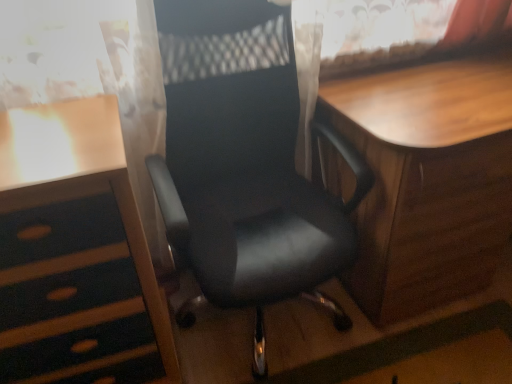
Question: From a real-world perspective, is wooden desk at left located higher than wooden table at center?

Choices:
 (A) no
 (B) yes

Answer: (B)

Question: Is the position of wooden desk at left less distant than that of wooden table at center?

Choices:
 (A) yes
 (B) no

Answer: (A)

Question: Can you confirm if wooden desk at left is smaller than wooden table at center?

Choices:
 (A) no
 (B) yes

Answer: (B)

Question: Is wooden desk at left oriented away from wooden table at center?

Choices:
 (A) yes
 (B) no

Answer: (B)

Question: Considering the relative positions of wooden desk at left and wooden table at center in the image provided, is wooden desk at left to the right of wooden table at center from the viewer's perspective?

Choices:
 (A) yes
 (B) no

Answer: (B)

Question: Visually, is wooden desk at left positioned to the left or to the right of black leather chair at center?

Choices:
 (A) left
 (B) right

Answer: (A)

Question: From the image's perspective, is wooden desk at left above or below black leather chair at center?

Choices:
 (A) below
 (B) above

Answer: (A)

Question: Is wooden desk at left spatially inside black leather chair at center, or outside of it?

Choices:
 (A) inside
 (B) outside

Answer: (B)

Question: Considering the positions of wooden desk at left and black leather chair at center in the image, is wooden desk at left taller or shorter than black leather chair at center?

Choices:
 (A) short
 (B) tall

Answer: (A)

Question: In the image, is black leather chair at center positioned in front of or behind wooden desk at left?

Choices:
 (A) behind
 (B) front

Answer: (B)

Question: Is black leather chair at center inside the boundaries of wooden desk at left, or outside?

Choices:
 (A) inside
 (B) outside

Answer: (B)

Question: From a real-world perspective, is black leather chair at center above or below wooden desk at left?

Choices:
 (A) below
 (B) above

Answer: (B)

Question: Based on their sizes in the image, would you say black leather chair at center is bigger or smaller than wooden desk at left?

Choices:
 (A) big
 (B) small

Answer: (A)

Question: Is point (80, 178) closer or farther from the camera than point (465, 99)?

Choices:
 (A) farther
 (B) closer

Answer: (B)

Question: Is wooden desk at left wider or thinner than wooden table at center?

Choices:
 (A) wide
 (B) thin

Answer: (B)